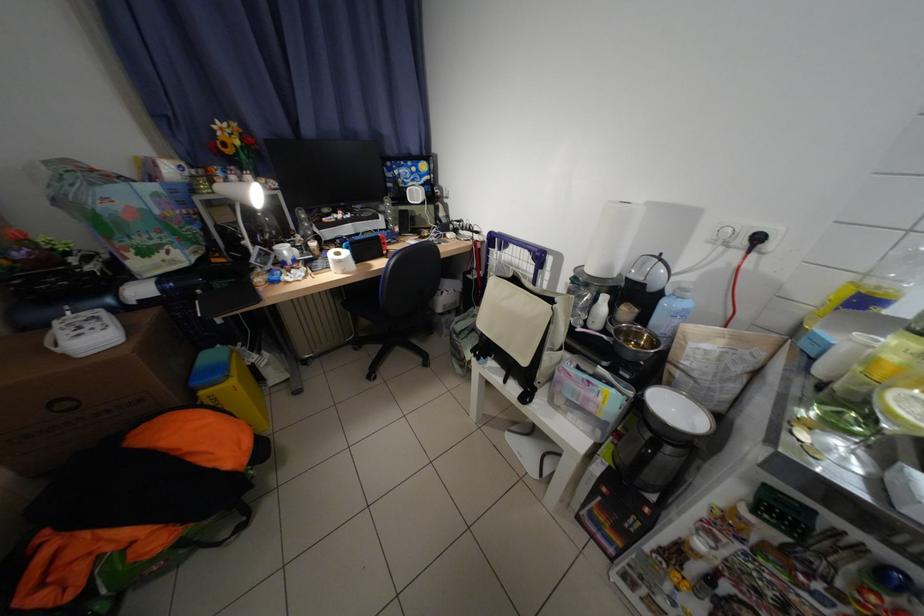
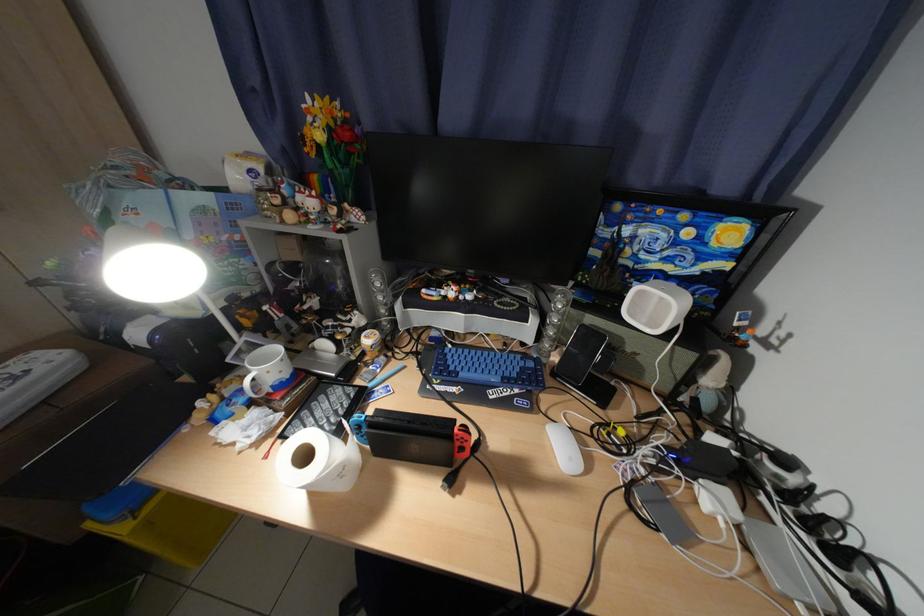
Question: I am providing you with two images of the same scene from different viewpoints. After the viewpoint changes to image2, which objects are now occluded?

Choices:
 (A) blue pen
 (B) blue and white tube
 (C) blue keyboard keys
 (D) none of these

Answer: (D)